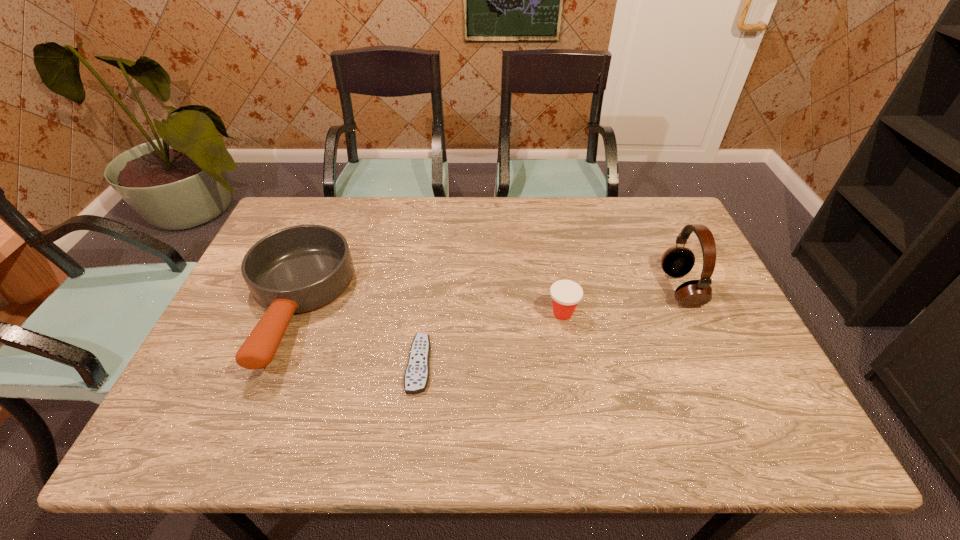
Locate an element on the screen. This screenshot has width=960, height=540. the tallest object is located at coordinates (677, 261).

Find the location of a particular element. This screenshot has height=540, width=960. the rightmost object is located at coordinates (677, 261).

The width and height of the screenshot is (960, 540). Identify the location of pan. 298,269.

This screenshot has width=960, height=540. I want to click on the leftmost object, so click(x=298, y=269).

Identify the location of the third tallest object. (566, 294).

Where is `the second object from right to left`? the second object from right to left is located at coordinates (566, 294).

At what (x,y) coordinates should I click in order to perform the action: click on remote control. Please return your answer as a coordinate pair (x, y). Image resolution: width=960 pixels, height=540 pixels. Looking at the image, I should click on (416, 377).

Identify the location of the shortest object. (416, 377).

Where is `free location located 0.200m on the ear pads of the rightmost object`? The width and height of the screenshot is (960, 540). free location located 0.200m on the ear pads of the rightmost object is located at coordinates [591, 289].

Where is `free space located on the ear pads of the rightmost object`? This screenshot has height=540, width=960. free space located on the ear pads of the rightmost object is located at coordinates (544, 289).